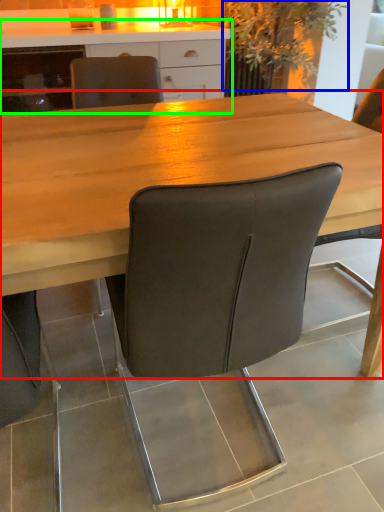
Question: Which object is the closest to the table (highlighted by a red box)? Choose among these: plant (highlighted by a blue box) or cabinetry (highlighted by a green box).

Choices:
 (A) plant
 (B) cabinetry

Answer: (B)